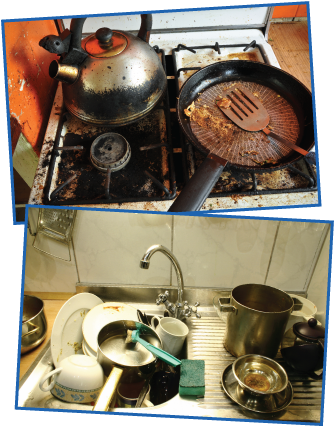
At what (x,y) coordinates should I click in order to perform the action: click on upside down coffee cup in sink of dirty dishes. Please return your answer as a coordinate pair (x, y). Looking at the image, I should click on (80, 376).